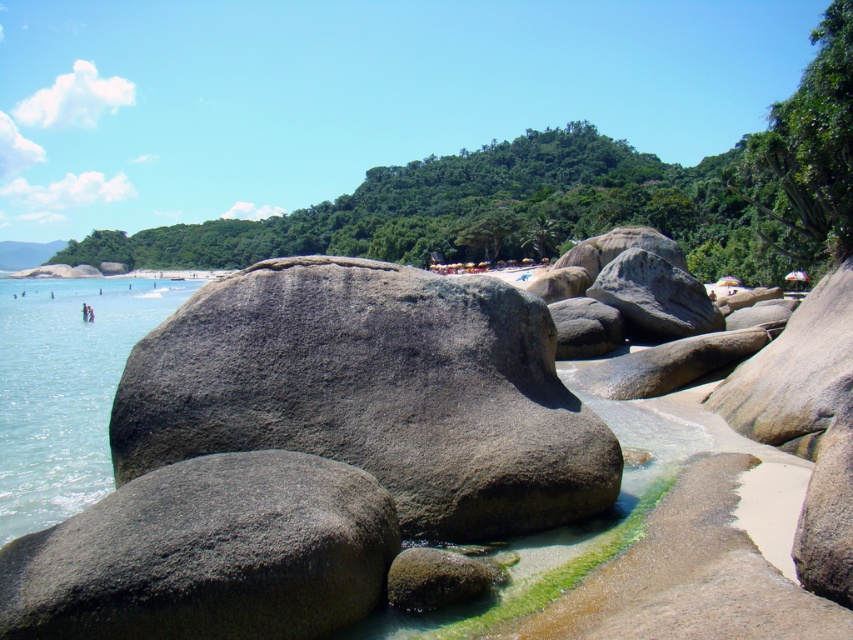
Is gray rough boulder at center shorter than gray textured rock at lower left?

No, gray rough boulder at center is not shorter than gray textured rock at lower left.

Does gray rough boulder at center have a larger size compared to gray textured rock at lower left?

Correct, gray rough boulder at center is larger in size than gray textured rock at lower left.

Who is more forward, [473,433] or [323,544]?

Point [323,544] is in front.

Find the location of a particular element. Image resolution: width=853 pixels, height=640 pixels. gray rough boulder at center is located at coordinates (374, 392).

Can you confirm if gray textured rock at lower left is wider than clear water at left?

No, gray textured rock at lower left is not wider than clear water at left.

Is gray textured rock at lower left to the right of clear water at left from the viewer's perspective?

Indeed, gray textured rock at lower left is positioned on the right side of clear water at left.

What do you see at coordinates (207, 554) in the screenshot?
I see `gray textured rock at lower left` at bounding box center [207, 554].

Where is `gray textured rock at lower left`? gray textured rock at lower left is located at coordinates (207, 554).

Can you confirm if gray rough boulder at center is thinner than clear water at left?

Yes.

Can you confirm if gray rough boulder at center is taller than clear water at left?

No, gray rough boulder at center is not taller than clear water at left.

Who is more distant from viewer, (521, 502) or (73, 461)?

Point (73, 461)

What are the coordinates of `gray rough boulder at center` in the screenshot? It's located at (374, 392).